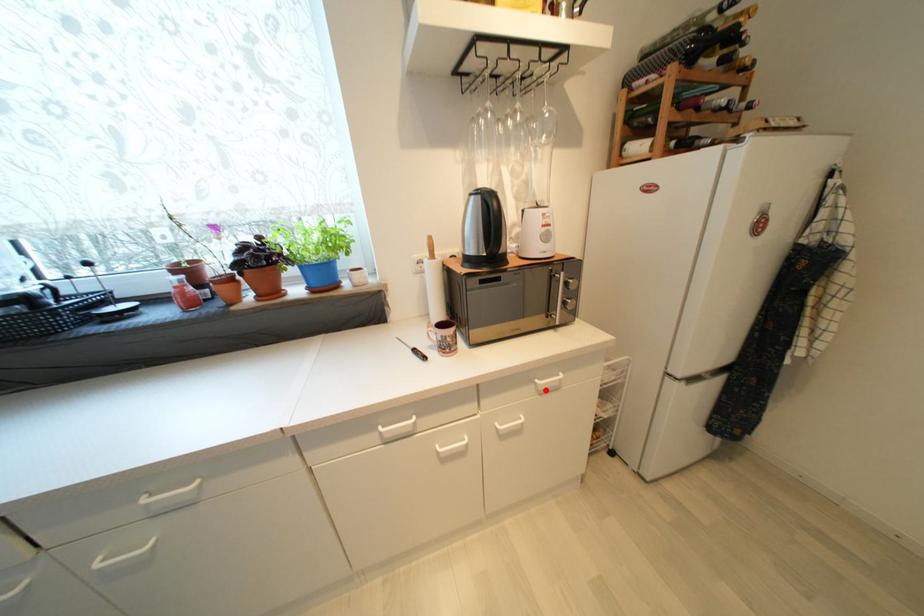
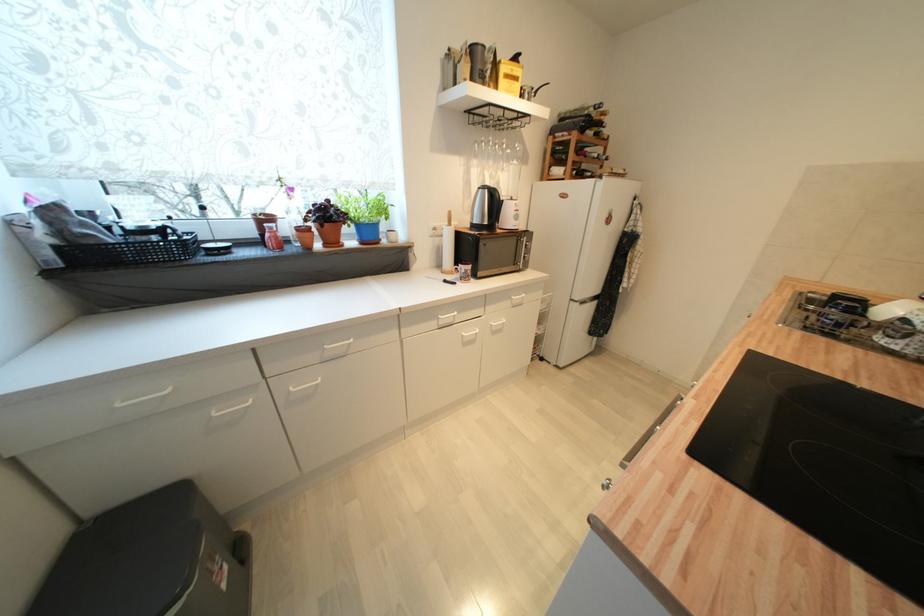
Locate, in the second image, the point that corresponds to the highlighted location in the first image.

(518, 304)